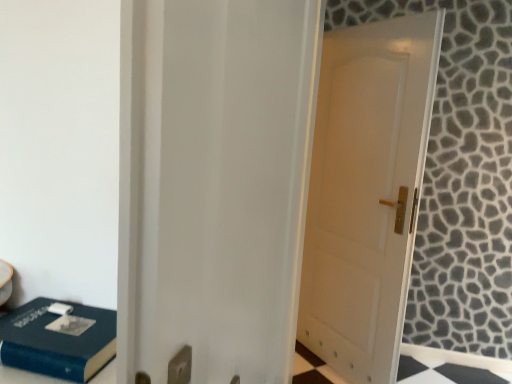
What do you see at coordinates (214, 184) in the screenshot? I see `white glossy door at center` at bounding box center [214, 184].

Identify the location of white glossy door at center. (214, 184).

Are white matte door at center and white glossy door at center making contact?

No, white matte door at center is not with white glossy door at center.

Is white matte door at center situated inside white glossy door at center or outside?

white matte door at center cannot be found inside white glossy door at center.

Which object is wider, white matte door at center or white glossy door at center?

Wider between the two is white glossy door at center.

Is point (394, 287) positioned after point (138, 68)?

Yes, it is behind point (138, 68).

Could you tell me if white glossy door at center is turned towards blue matte book at lower left?

Yes, white glossy door at center is aimed at blue matte book at lower left.

Which is behind, white glossy door at center or blue matte book at lower left?

blue matte book at lower left is further away from the camera.

From the image's perspective, relative to blue matte book at lower left, is white glossy door at center above or below?

From the image's perspective, white glossy door at center appears above blue matte book at lower left.

Identify the location of box that appears behind the white glossy door at center. The image size is (512, 384). (57, 341).

In the scene shown: Which of these two, blue matte book at lower left or white matte door at center, is wider?

With larger width is blue matte book at lower left.

Considering the relative sizes of blue matte book at lower left and white matte door at center in the image provided, is blue matte book at lower left shorter than white matte door at center?

Yes, blue matte book at lower left is shorter than white matte door at center.

Could white matte door at center be considered to be inside blue matte book at lower left?

No, white matte door at center is located outside of blue matte book at lower left.

From the image's perspective, which one is positioned higher, blue matte book at lower left or white matte door at center?

white matte door at center, from the image's perspective.

Is white glossy door at center bigger than white matte door at center?

Incorrect, white glossy door at center is not larger than white matte door at center.

In the image, is white glossy door at center positioned in front of or behind white matte door at center?

white glossy door at center is positioned closer to the viewer than white matte door at center.

How far apart are white glossy door at center and white matte door at center?

A distance of 4.43 feet exists between white glossy door at center and white matte door at center.

This screenshot has width=512, height=384. I want to click on screen door that appears below the white matte door at center (from the image's perspective), so coord(214,184).

Is blue matte book at lower left spatially inside white glossy door at center, or outside of it?

blue matte book at lower left exists outside the volume of white glossy door at center.

Which is more to the left, blue matte book at lower left or white glossy door at center?

Positioned to the left is blue matte book at lower left.

You are a GUI agent. You are given a task and a screenshot of the screen. Output one action in this format:
    pyautogui.click(x=<x>, y=<y>)
    Task: Click on the screen door in front of the blue matte book at lower left
    
    Given the screenshot: What is the action you would take?
    pyautogui.click(x=214, y=184)

Can you confirm if blue matte book at lower left is wider than white glossy door at center?

Yes.

From their relative heights in the image, would you say white matte door at center is taller or shorter than blue matte book at lower left?

Clearly, white matte door at center is taller compared to blue matte book at lower left.

Between point (301, 281) and point (92, 372), which one is positioned in front?

The point (92, 372) is closer.

From a real-world perspective, which is physically above, white matte door at center or blue matte book at lower left?

white matte door at center is physically above.

Identify the location of box in front of the white matte door at center. (57, 341).

The image size is (512, 384). I want to click on screen door to the left of white matte door at center, so click(x=214, y=184).

You are a GUI agent. You are given a task and a screenshot of the screen. Output one action in this format:
    pyautogui.click(x=<x>, y=<y>)
    Task: Click on the box that is below the white glossy door at center (from the image's perspective)
    The width and height of the screenshot is (512, 384).
    Given the screenshot: What is the action you would take?
    pyautogui.click(x=57, y=341)

Which object lies nearer to the anchor point white matte door at center, blue matte book at lower left or white glossy door at center?

Based on the image, white glossy door at center appears to be nearer to white matte door at center.

From the image, which object appears to be farther from blue matte book at lower left, white matte door at center or white glossy door at center?

The object further to blue matte book at lower left is white matte door at center.

Estimate the real-world distances between objects in this image. Which object is further from white glossy door at center, blue matte book at lower left or white matte door at center?

Based on the image, white matte door at center appears to be further to white glossy door at center.

Looking at this image, estimate the real-world distances between objects in this image. Which object is closer to white glossy door at center, white matte door at center or blue matte book at lower left?

Based on the image, blue matte book at lower left appears to be nearer to white glossy door at center.

From the image, which object appears to be farther from blue matte book at lower left, white glossy door at center or white matte door at center?

The object further to blue matte book at lower left is white matte door at center.

Estimate the real-world distances between objects in this image. Which object is further from white matte door at center, white glossy door at center or blue matte book at lower left?

The object further to white matte door at center is blue matte book at lower left.

Where is `box between white glossy door at center and white matte door at center in the front-back direction`? This screenshot has height=384, width=512. box between white glossy door at center and white matte door at center in the front-back direction is located at coordinates (57, 341).